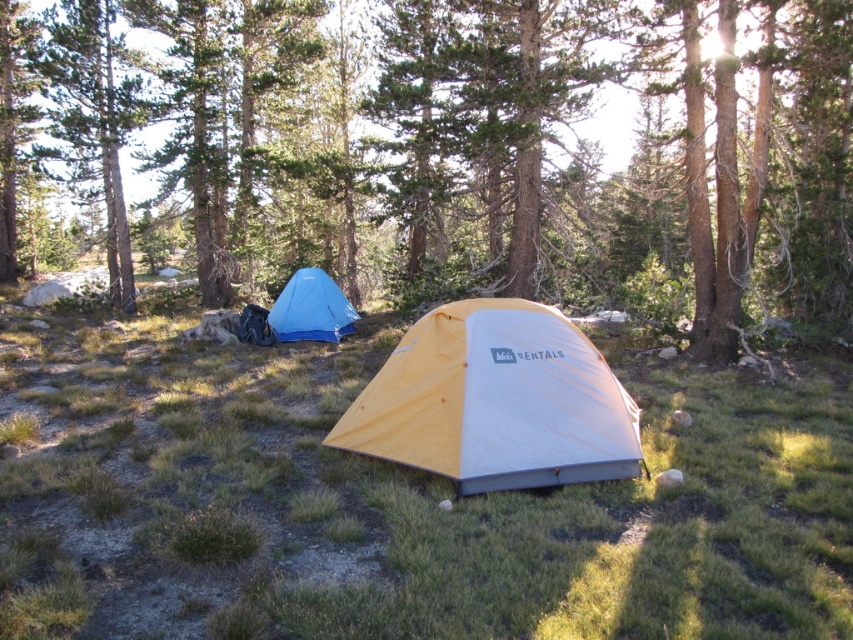
You are standing at the yellow and white tent with the word RENTALS printed on its side. You see two points in the scene, one at coordinates point (393, 403) and another at point (300, 276). Which point is closer to you?

Point (393, 403) is closer to the viewer than point (300, 276).

You are setting up a picnic area between the brown textured tree at center and the yellow fabric tent at center. Which object should you place your picnic blanket closer to if you want it to be under more shade?

The brown textured tree at center is larger in size than the yellow fabric tent at center, so placing the picnic blanket closer to the brown textured tree at center would provide more shade.

You are standing in the camping area and want to determine which of the two points, point (129, 388) or point (512, 486), is closer to you. Based on their positions, which point is nearer?

Point (129, 388) is closer to you because it is further to the viewer than point (512, 486).